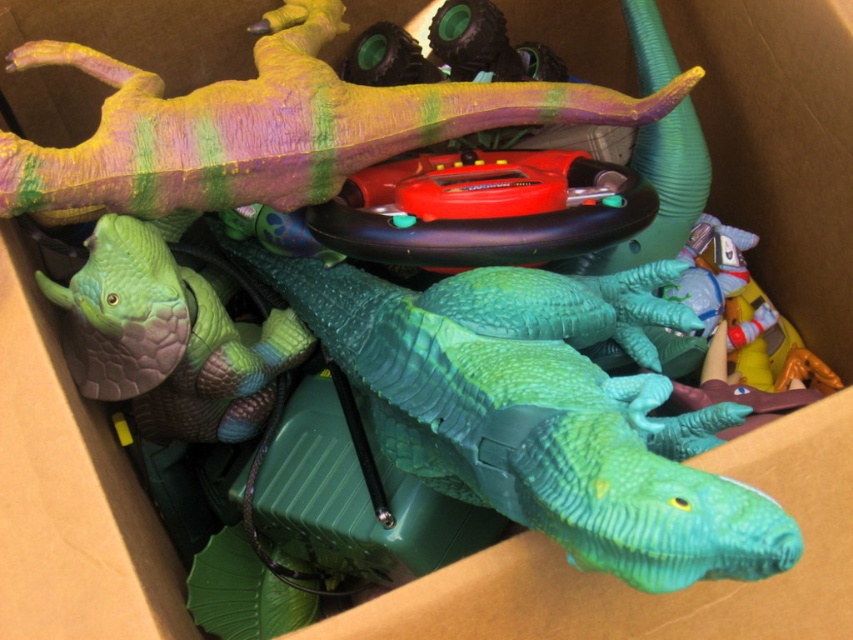
You are organizing a toy box and see the green plastic dinosaur at center and the multicolored rubber dinosaur at upper center. Which dinosaur is positioned to the right side of the other?

The green plastic dinosaur at center is positioned to the right of the multicolored rubber dinosaur at upper center.

You are a child trying to reach the multicolored rubber dinosaur at upper center from the green plastic dinosaur at center. The distance between them is 9.07 inches. If your hand can only extend 8 inches, can you reach it without moving?

The distance between the green plastic dinosaur at center and the multicolored rubber dinosaur at upper center is 9.07 inches. Since your hand can only extend 8 inches, you cannot reach the multicolored rubber dinosaur at upper center without moving.

You are a child who wants to stack the green plastic dinosaur at center on top of the multicolored rubber dinosaur at upper center. Can you do this without the stack falling over?

The green plastic dinosaur at center has a lesser height compared to the multicolored rubber dinosaur at upper center, so it is possible to stack them without the stack falling over as long as the base is stable.